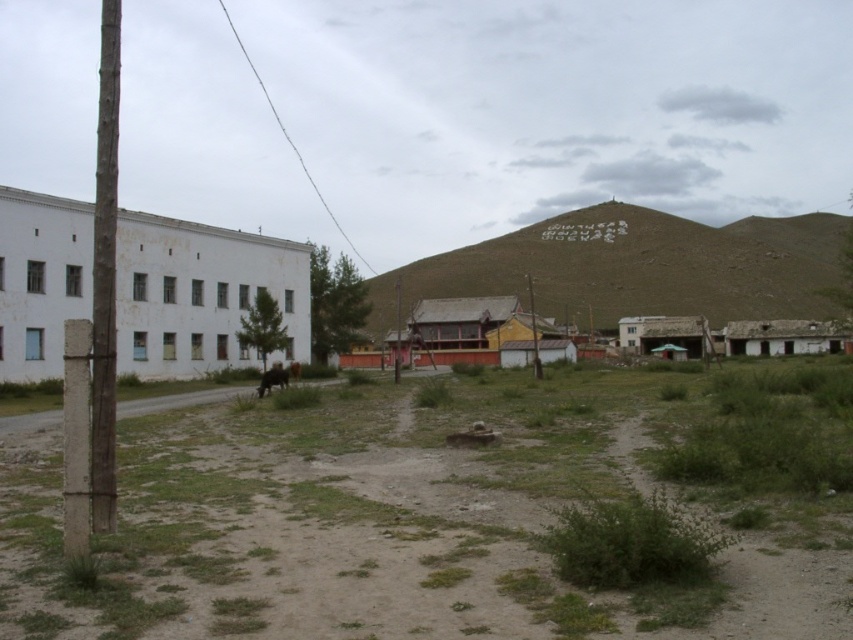
Question: Which object appears farthest from the camera in this image?

Choices:
 (A) brown furry dog at center
 (B) green grassy hillside at center
 (C) brown wooden pole at left
 (D) dull brown dirt field at center

Answer: (B)

Question: Which point appears farthest from the camera in this image?

Choices:
 (A) (111, 282)
 (B) (259, 396)
 (C) (625, 288)
 (D) (846, 580)

Answer: (C)

Question: Is brown wooden pole at left bigger than brown furry dog at center?

Choices:
 (A) no
 (B) yes

Answer: (B)

Question: Is dull brown dirt field at center above brown wooden pole at left?

Choices:
 (A) no
 (B) yes

Answer: (A)

Question: Considering the real-world distances, which object is closest to the dull brown dirt field at center?

Choices:
 (A) brown wooden pole at left
 (B) brown furry dog at center
 (C) green grassy hillside at center

Answer: (B)

Question: Is green grassy hillside at center thinner than brown furry dog at center?

Choices:
 (A) no
 (B) yes

Answer: (A)